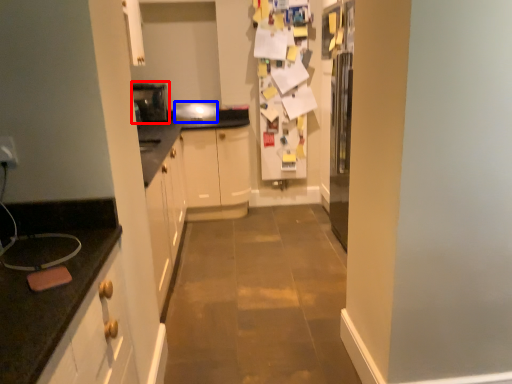
Question: Which object appears closest to the camera in this image, appliance (highlighted by a red box) or appliance (highlighted by a blue box)?

Choices:
 (A) appliance
 (B) appliance

Answer: (A)